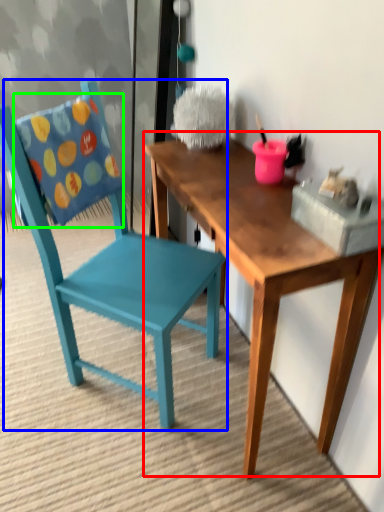
Question: Which object is positioned closest to table (highlighted by a red box)? Select from chair (highlighted by a blue box) and pillow (highlighted by a green box).

Choices:
 (A) chair
 (B) pillow

Answer: (A)